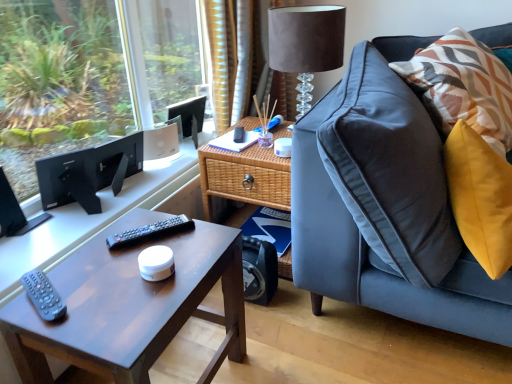
Question: Based on their positions, is matte black computer desk at left located to the left or right of black plastic remote at lower left, placed as the 2th remote when sorted from top to bottom?

Choices:
 (A) left
 (B) right

Answer: (A)

Question: Is matte black computer desk at left in front of or behind black plastic remote at lower left, acting as the second remote starting from the back, in the image?

Choices:
 (A) behind
 (B) front

Answer: (A)

Question: Considering the real-world distances, which object is closest to the woven wood side table at center?

Choices:
 (A) black plastic remote at center, placed as the 2th remote when sorted from left to right
 (B) suede lampshade at upper right
 (C) black matte computer monitor at left
 (D) black plastic remote at lower left, placed as the 2th remote when sorted from top to bottom
 (E) patterned fabric pillow at right

Answer: (B)

Question: Which object is positioned farthest from the black matte computer monitor at left?

Choices:
 (A) matte brown coffee table at lower left
 (B) woven wood side table at center
 (C) suede lampshade at upper right
 (D) matte black computer desk at left
 (E) black plastic remote at lower left, which ranks as the 2th remote in right-to-left order

Answer: (C)